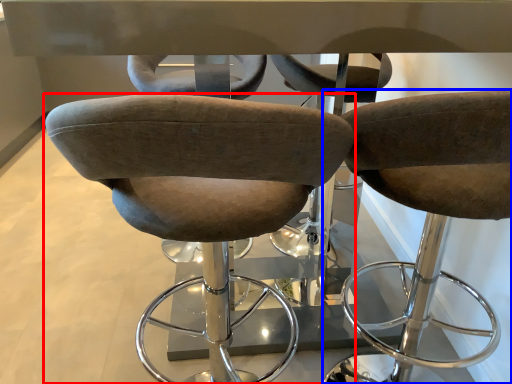
Question: Which object appears farthest to the camera in this image, chair (highlighted by a red box) or chair (highlighted by a blue box)?

Choices:
 (A) chair
 (B) chair

Answer: (B)